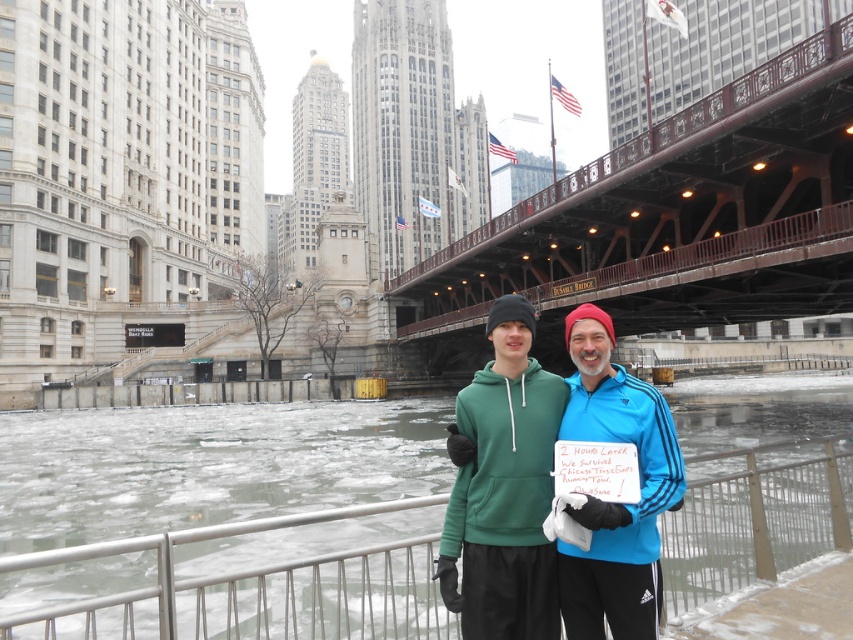
The image size is (853, 640). What do you see at coordinates (207, 464) in the screenshot?
I see `frozen ice at center` at bounding box center [207, 464].

Is point (343, 451) closer to camera compared to point (596, 579)?

No, (343, 451) is behind (596, 579).

Where is `frozen ice at center`? This screenshot has width=853, height=640. frozen ice at center is located at coordinates (207, 464).

Is frozen ice at center shorter than brown wooden bridge at center?

Indeed, frozen ice at center has a lesser height compared to brown wooden bridge at center.

Is point (0, 588) closer to viewer compared to point (485, 230)?

Yes, point (0, 588) is closer to viewer.

Where is `frozen ice at center`? frozen ice at center is located at coordinates (207, 464).

Which is in front, point (405, 276) or point (463, 429)?

Point (463, 429) is more forward.

Measure the distance between brown wooden bridge at center and camera.

The distance of brown wooden bridge at center from camera is 104.53 feet.

Who is more forward, (786, 131) or (651, 440)?

Point (651, 440) is in front.

The image size is (853, 640). I want to click on brown wooden bridge at center, so pyautogui.click(x=647, y=196).